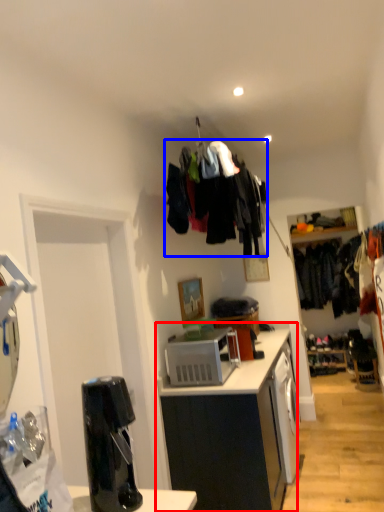
Question: Which object is closer to the camera taking this photo, cabinetry (highlighted by a red box) or clothing (highlighted by a blue box)?

Choices:
 (A) cabinetry
 (B) clothing

Answer: (A)